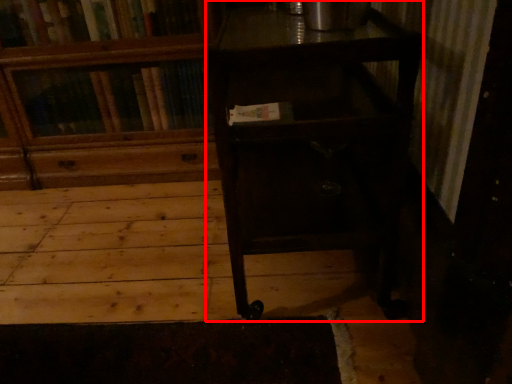
Question: Observing the image, what is the correct spatial positioning of table (annotated by the red box) in reference to bookcase?

Choices:
 (A) left
 (B) right

Answer: (B)